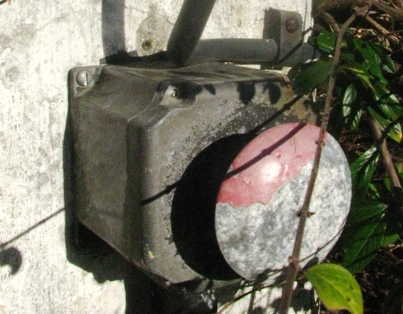
This screenshot has width=403, height=314. What are the coordinates of `faded and wethered concrete wall` in the screenshot? It's located at (29, 36).